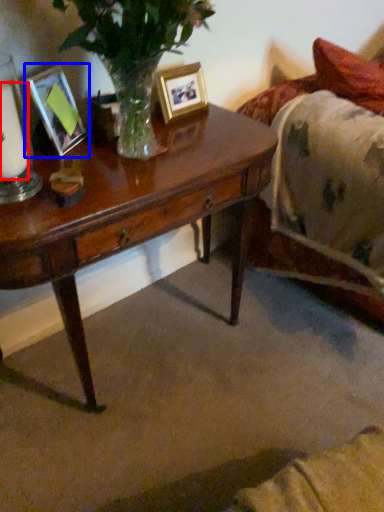
Question: Which point is closer to the camera, candle (highlighted by a red box) or picture frame (highlighted by a blue box)?

Choices:
 (A) candle
 (B) picture frame

Answer: (A)